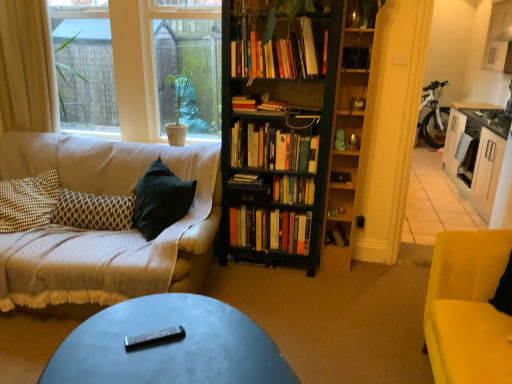
Identify the location of vacant area located to the right-hand side of black plastic remote control at center. This screenshot has width=512, height=384. tap(205, 341).